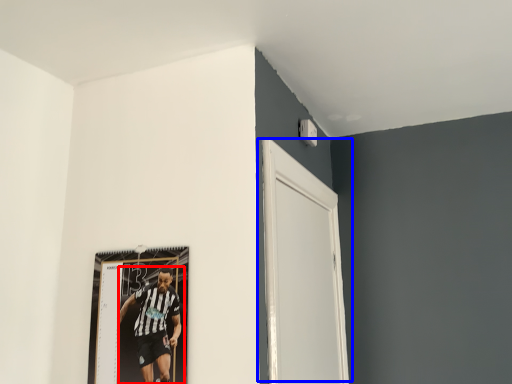
Question: Among these objects, which one is nearest to the camera, person (highlighted by a red box) or door (highlighted by a blue box)?

Choices:
 (A) person
 (B) door

Answer: (B)